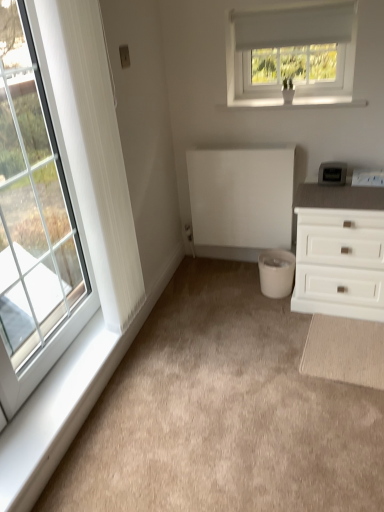
The width and height of the screenshot is (384, 512). Describe the element at coordinates (96, 156) in the screenshot. I see `white textured curtain at left` at that location.

Find the location of a particular element. The width and height of the screenshot is (384, 512). white glass window at left, positioned as the first window in bottom-to-top order is located at coordinates [35, 218].

Locate an element on the screen. white plastic window sill at upper center, which is the 2th window sill from bottom to top is located at coordinates (299, 103).

Measure the distance between point (87, 353) and camera.

Point (87, 353) and camera are 6.21 feet apart.

Locate an element on the screen. This screenshot has height=512, width=384. white matte chest of drawers at right is located at coordinates (340, 251).

What do you see at coordinates (291, 55) in the screenshot? The image size is (384, 512). I see `white fabric window at upper center, which ranks as the 2th window in left-to-right order` at bounding box center [291, 55].

You are a GUI agent. You are given a task and a screenshot of the screen. Output one action in this format:
    pyautogui.click(x=<x>, y=<y>)
    Task: Click on the white textured curtain at left
    The height and width of the screenshot is (512, 384).
    Given the screenshot: What is the action you would take?
    pyautogui.click(x=96, y=156)

In order to click on screen door on the left of white matte chest of drawers at right in this screenshot , I will do `click(241, 196)`.

Based on the photo, from the image's perspective, between white matte chest of drawers at right and white matte radiator at center, who is located below?

white matte chest of drawers at right, from the image's perspective.

Is point (322, 202) closer or farther from the camera than point (192, 225)?

Clearly, point (322, 202) is closer to the camera than point (192, 225).

Considering the relative positions of white matte chest of drawers at right and white matte radiator at center in the image provided, is white matte chest of drawers at right behind white matte radiator at center?

No, white matte chest of drawers at right is in front of white matte radiator at center.

Is white matte chest of drawers at right placed right next to white plastic window sill at upper center, which is the 2th window sill from bottom to top?

No, white matte chest of drawers at right is not with white plastic window sill at upper center, which is the 2th window sill from bottom to top.

Where is `window sill that is above the white matte chest of drawers at right (from a real-world perspective)`? window sill that is above the white matte chest of drawers at right (from a real-world perspective) is located at coordinates (299, 103).

In the scene shown: Which object is closer to the camera, white matte chest of drawers at right or white plastic window sill at upper center, which is the 2th window sill from bottom to top?

white matte chest of drawers at right is in front.

Is white matte chest of drawers at right to the left of white plastic window sill at upper center, which is the second window sill in left-to-right order, from the viewer's perspective?

Incorrect, white matte chest of drawers at right is not on the left side of white plastic window sill at upper center, which is the second window sill in left-to-right order.

Considering the relative positions of white fabric window at upper center, which is counted as the 1th window, starting from the top, and beige carpet at center in the image provided, is white fabric window at upper center, which is counted as the 1th window, starting from the top, in front of beige carpet at center?

No, it is not.

In the scene shown: From a real-world perspective, is white fabric window at upper center, which is the second window from bottom to top, physically located above or below beige carpet at center?

In terms of real-world spatial position, white fabric window at upper center, which is the second window from bottom to top, is above beige carpet at center.

This screenshot has width=384, height=512. In order to click on plain that appears below the white fabric window at upper center, which is counted as the 1th window, starting from the top (from a real-world perspective) in this screenshot , I will do click(222, 413).

Is white fabric window at upper center, which ranks as the 2th window in left-to-right order, completely or partially outside of beige carpet at center?

Yes, white fabric window at upper center, which ranks as the 2th window in left-to-right order, is located beyond the bounds of beige carpet at center.

Can you confirm if white glass window at left, the second window from the right, is positioned to the left of white plastic window sill at lower left, which is the first window sill from bottom to top?

Correct, you'll find white glass window at left, the second window from the right, to the left of white plastic window sill at lower left, which is the first window sill from bottom to top.

Is there a large distance between white glass window at left, the 2th window in the top-to-bottom sequence, and white plastic window sill at lower left, which is the first window sill from bottom to top?

No, white glass window at left, the 2th window in the top-to-bottom sequence, is in close proximity to white plastic window sill at lower left, which is the first window sill from bottom to top.

Could white plastic window sill at lower left, positioned as the second window sill in right-to-left order, be considered to be inside white glass window at left, the 1th window in the left-to-right sequence?

Definitely not — white plastic window sill at lower left, positioned as the second window sill in right-to-left order, is not inside white glass window at left, the 1th window in the left-to-right sequence.

Which of these two, white glass window at left, the 1th window in the left-to-right sequence, or white plastic window sill at lower left, the second window sill positioned from the top, is wider?

white plastic window sill at lower left, the second window sill positioned from the top.

Can you confirm if white fabric window at upper center, which ranks as the 2th window in left-to-right order, is bigger than white glass window at left, the 1th window in the left-to-right sequence?

Actually, white fabric window at upper center, which ranks as the 2th window in left-to-right order, might be smaller than white glass window at left, the 1th window in the left-to-right sequence.

I want to click on window positioned vertically above the white glass window at left, the 1th window in the left-to-right sequence (from a real-world perspective), so click(x=291, y=55).

Which object is further away from the camera taking this photo, white fabric window at upper center, which is the 1th window from right to left, or white glass window at left, the 1th window in the left-to-right sequence?

white fabric window at upper center, which is the 1th window from right to left.

Which object is wider, white fabric window at upper center, which is the 1th window from right to left, or white glass window at left, the 2th window in the top-to-bottom sequence?

With larger width is white fabric window at upper center, which is the 1th window from right to left.

From the image's perspective, which one is positioned higher, white matte chest of drawers at right or white fabric window at upper center, which is counted as the 1th window, starting from the top?

white fabric window at upper center, which is counted as the 1th window, starting from the top, is shown above in the image.

Between white matte chest of drawers at right and white fabric window at upper center, which is the 1th window from right to left, which one has less height?

Standing shorter between the two is white fabric window at upper center, which is the 1th window from right to left.

Visually, is white matte chest of drawers at right positioned to the left or to the right of white fabric window at upper center, which is the 1th window from right to left?

Based on their positions, white matte chest of drawers at right is located to the right of white fabric window at upper center, which is the 1th window from right to left.

Considering the relative sizes of white matte chest of drawers at right and white fabric window at upper center, which is counted as the 1th window, starting from the top, in the image provided, is white matte chest of drawers at right bigger than white fabric window at upper center, which is counted as the 1th window, starting from the top,?

Yes, white matte chest of drawers at right is bigger than white fabric window at upper center, which is counted as the 1th window, starting from the top.

Is white matte radiator at center at the back of white glass window at left, the 2th window in the top-to-bottom sequence?

That's not correct — white glass window at left, the 2th window in the top-to-bottom sequence, is not looking away from white matte radiator at center.

Looking at their sizes, would you say white glass window at left, the 1th window in the left-to-right sequence, is wider or thinner than white matte radiator at center?

Clearly, white glass window at left, the 1th window in the left-to-right sequence, has less width compared to white matte radiator at center.

From a real-world perspective, does white glass window at left, the 2th window in the top-to-bottom sequence, sit lower than white matte radiator at center?

No, from a real-world perspective, white glass window at left, the 2th window in the top-to-bottom sequence, is not under white matte radiator at center.

Does white glass window at left, the 2th window in the top-to-bottom sequence, touch white matte radiator at center?

white glass window at left, the 2th window in the top-to-bottom sequence, is not next to white matte radiator at center, and they're not touching.

Find the location of a particular element. This screenshot has height=512, width=384. chest of drawers on the right of white matte radiator at center is located at coordinates (340, 251).

Locate an element on the screen. This screenshot has height=512, width=384. window sill that is above the white matte chest of drawers at right (from a real-world perspective) is located at coordinates (299, 103).

Which object lies nearer to the anchor point white textured curtain at left, white plastic window sill at upper center, which is the 2th window sill from bottom to top, or white fabric window at upper center, which ranks as the 2th window in left-to-right order?

white plastic window sill at upper center, which is the 2th window sill from bottom to top, lies closer to white textured curtain at left than the other object.

Consider the image. Estimate the real-world distances between objects in this image. Which object is closer to white plastic window sill at lower left, the second window sill positioned from the top, beige carpet at center or white plastic window sill at upper center, the 1th window sill from the top?

beige carpet at center.

Estimate the real-world distances between objects in this image. Which object is closer to white matte chest of drawers at right, white glass window at left, the 2th window in the top-to-bottom sequence, or white textured curtain at left?

The object closer to white matte chest of drawers at right is white textured curtain at left.

Which object lies nearer to the anchor point white plastic window sill at lower left, the second window sill positioned from the top, white matte chest of drawers at right or white fabric window at upper center, which is the second window from bottom to top?

Based on the image, white matte chest of drawers at right appears to be nearer to white plastic window sill at lower left, the second window sill positioned from the top.

Which object lies nearer to the anchor point white plastic window sill at upper center, positioned as the first window sill in right-to-left order, white matte radiator at center or white plastic window sill at lower left, positioned as the second window sill in right-to-left order?

Among the two, white matte radiator at center is located nearer to white plastic window sill at upper center, positioned as the first window sill in right-to-left order.

When comparing their distances from white fabric window at upper center, which is the 1th window from right to left, does white textured curtain at left or white plastic window sill at upper center, the 1th window sill from the top, seem further?

white textured curtain at left is positioned further to the anchor white fabric window at upper center, which is the 1th window from right to left.

Looking at the image, which one is located closer to white plastic window sill at lower left, positioned as the second window sill in right-to-left order, white glass window at left, positioned as the first window in bottom-to-top order, or white fabric window at upper center, which is the second window from bottom to top?

white glass window at left, positioned as the first window in bottom-to-top order.

From the image, which object appears to be farther from beige carpet at center, white glass window at left, the 1th window in the left-to-right sequence, or white matte chest of drawers at right?

white glass window at left, the 1th window in the left-to-right sequence.

At what (x,y) coordinates should I click in order to perform the action: click on plain that lies between white plastic window sill at upper center, which is the second window sill in left-to-right order, and white plastic window sill at lower left, the first window sill when ordered from left to right, from top to bottom. Please return your answer as a coordinate pair (x, y). This screenshot has height=512, width=384. Looking at the image, I should click on (222, 413).

At what (x,y) coordinates should I click in order to perform the action: click on screen door between white plastic window sill at upper center, positioned as the first window sill in right-to-left order, and white plastic window sill at lower left, the first window sill when ordered from left to right, in the up-down direction. Please return your answer as a coordinate pair (x, y). This screenshot has height=512, width=384. Looking at the image, I should click on (241, 196).

Locate an element on the screen. Image resolution: width=384 pixels, height=512 pixels. window between white fabric window at upper center, which is the 1th window from right to left, and beige carpet at center from top to bottom is located at coordinates (35, 218).

You are a GUI agent. You are given a task and a screenshot of the screen. Output one action in this format:
    pyautogui.click(x=<x>, y=<y>)
    Task: Click on the chest of drawers between beige carpet at center and white matte radiator at center along the z-axis
    The width and height of the screenshot is (384, 512).
    Given the screenshot: What is the action you would take?
    pos(340,251)